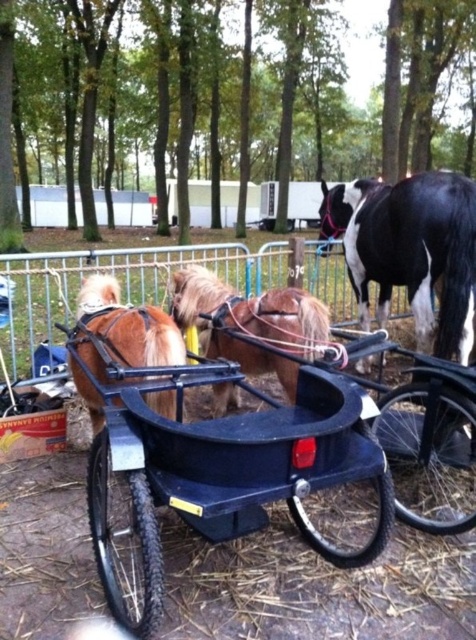
Is black and white textured horse at center positioned at the back of brown glossy horse at center?

Yes, black and white textured horse at center is further from the viewer.

Can you confirm if black and white textured horse at center is bigger than brown glossy horse at center?

Actually, black and white textured horse at center might be smaller than brown glossy horse at center.

This screenshot has width=476, height=640. Describe the element at coordinates (412, 252) in the screenshot. I see `black and white textured horse at center` at that location.

Identify the location of black and white textured horse at center. (412, 252).

Can you confirm if black plastic cart at center is shorter than shiny brown pony at center?

Correct, black plastic cart at center is not as tall as shiny brown pony at center.

Which of these two, black plastic cart at center or shiny brown pony at center, stands shorter?

Standing shorter between the two is black plastic cart at center.

Is point (358, 524) positioned behind point (279, 320)?

No, it is in front of (279, 320).

Where is `black plastic cart at center`? This screenshot has height=640, width=476. black plastic cart at center is located at coordinates (267, 472).

Can you confirm if shiny brown pony at center is wider than brown glossy horse at center?

Indeed, shiny brown pony at center has a greater width compared to brown glossy horse at center.

Image resolution: width=476 pixels, height=640 pixels. What do you see at coordinates (251, 323) in the screenshot? I see `shiny brown pony at center` at bounding box center [251, 323].

Who is more distant from viewer, (247, 317) or (95, 390)?

Positioned behind is point (247, 317).

The height and width of the screenshot is (640, 476). In order to click on shiny brown pony at center in this screenshot , I will do `click(251, 323)`.